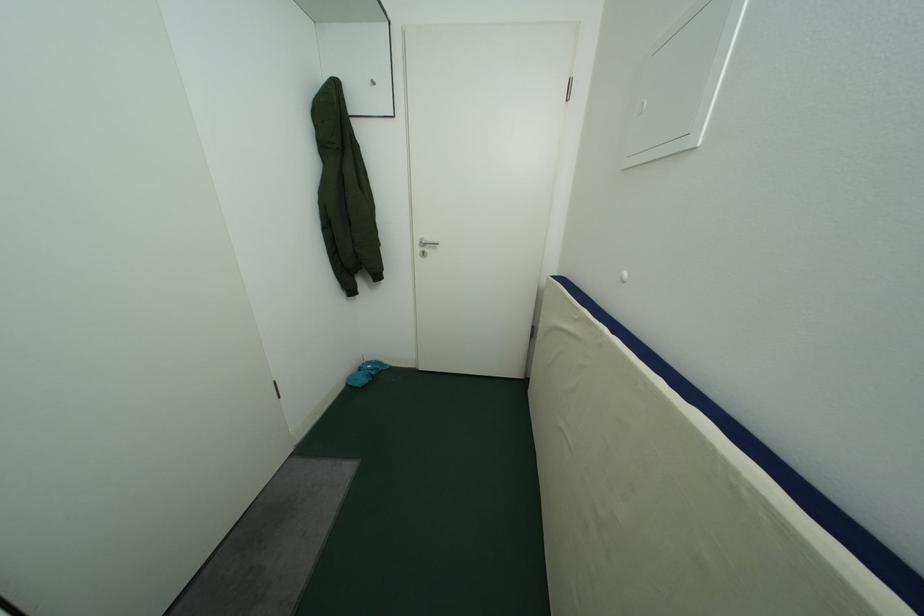
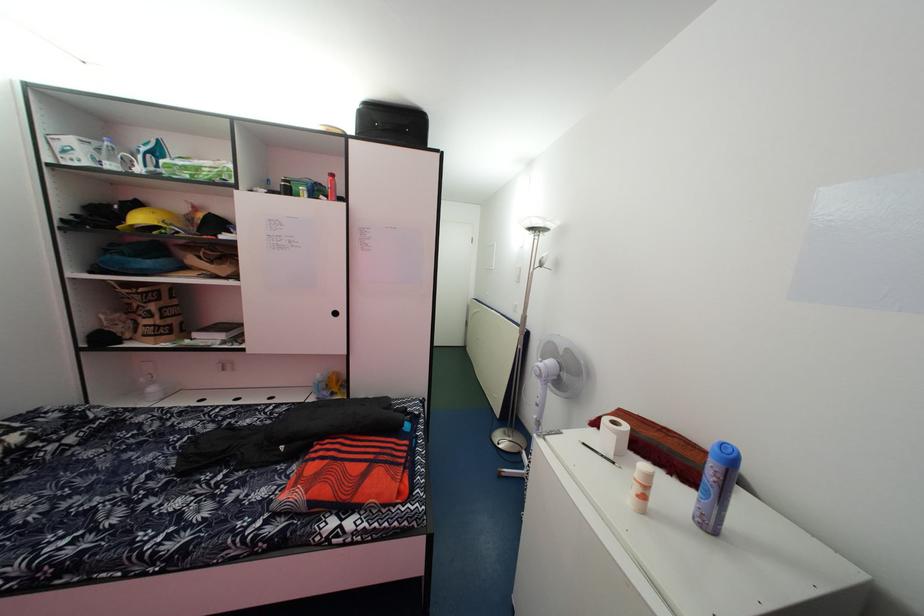
Question: Which direction would the cameraman need to move to produce the second image? Reply with the corresponding letter.

Choices:
 (A) Left
 (B) Right
 (C) Forward
 (D) Backward

Answer: (D)